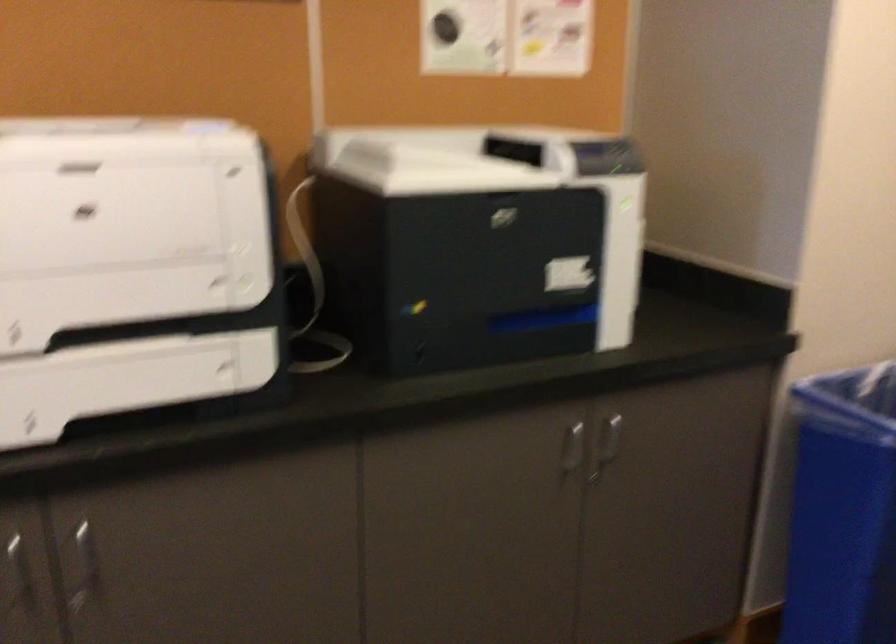
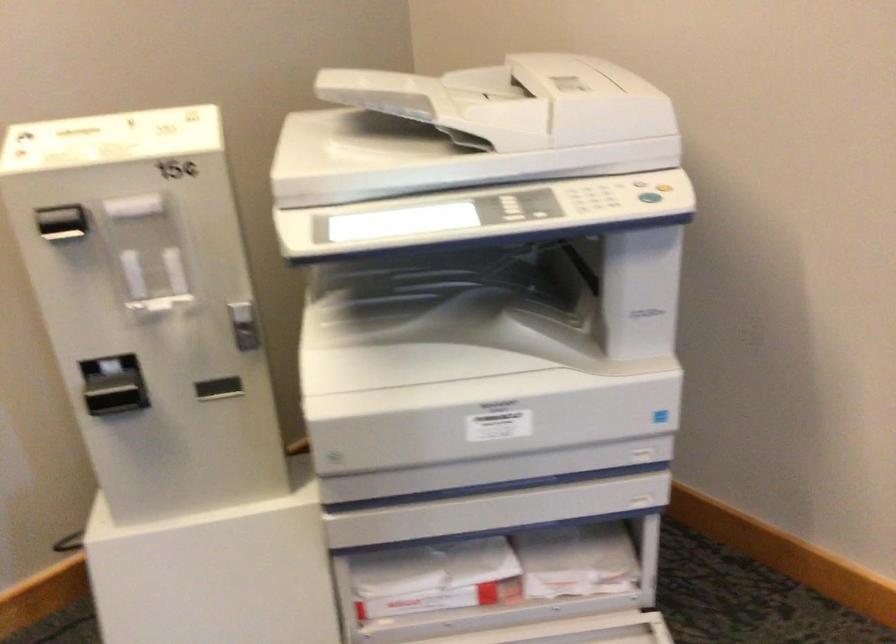
Based on the continuous images, in which direction is the camera rotating?

The rotation direction of the camera is right-down.